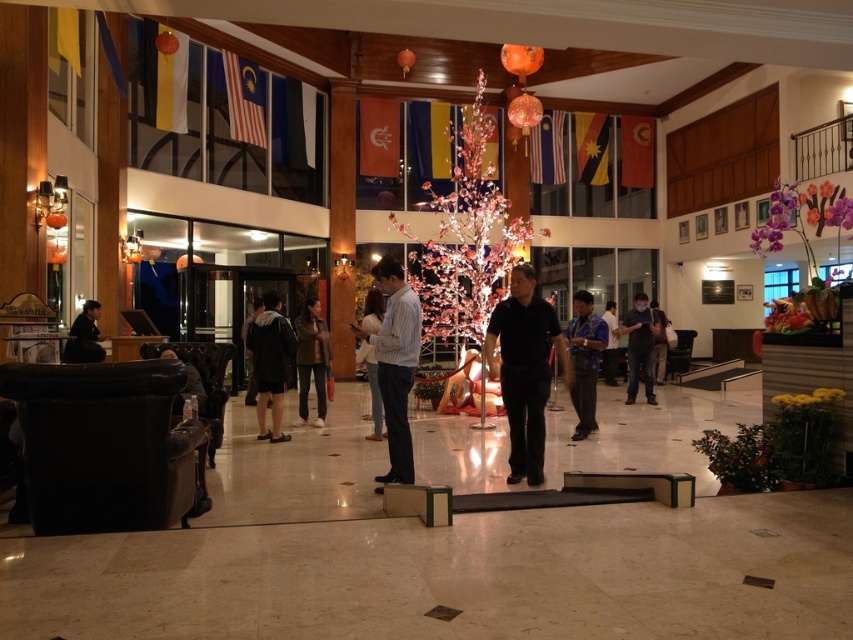
Question: Which object appears farthest from the camera in this image?

Choices:
 (A) black leather jacket at left
 (B) illuminated pink artificial tree at center
 (C) dark blue shirt at center

Answer: (C)

Question: Can you confirm if illuminated pink artificial tree at center is smaller than black matte shirt at center?

Choices:
 (A) yes
 (B) no

Answer: (B)

Question: Considering the real-world distances, which object is farthest from the brown leather jacket at center?

Choices:
 (A) black leather jacket at left
 (B) dark gray hoodie at center
 (C) blue fabric shirt at center
 (D) blue patterned shirt at center

Answer: (C)

Question: Can you confirm if blue patterned shirt at center is bigger than black leather jacket at left?

Choices:
 (A) yes
 (B) no

Answer: (A)

Question: Does light beige sweater at center have a smaller size compared to dark blue shirt at center?

Choices:
 (A) no
 (B) yes

Answer: (B)

Question: Which object is farther from the camera taking this photo?

Choices:
 (A) black leather jacket at left
 (B) black matte shirt at center
 (C) dark gray fabric jacket at right

Answer: (C)